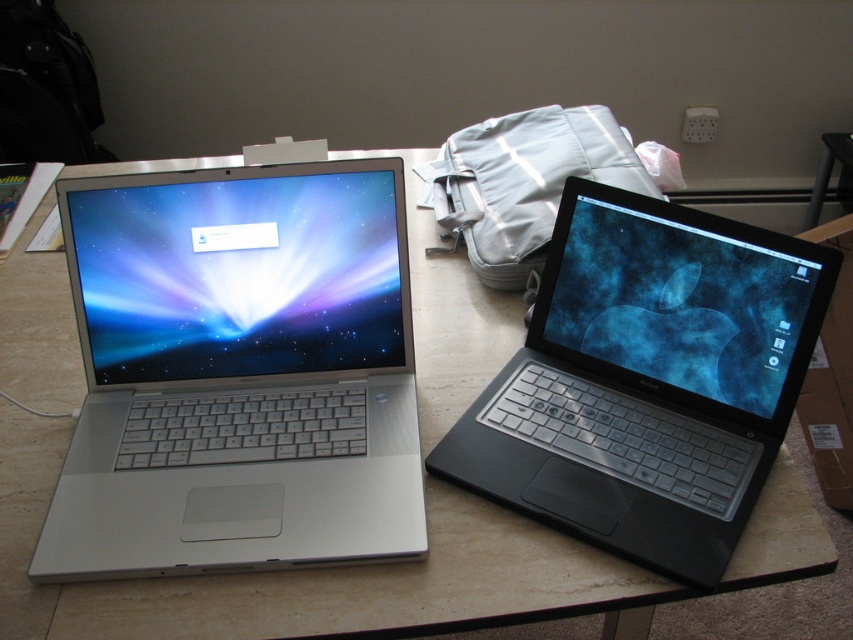
Question: Which point is closer to the camera?

Choices:
 (A) coord(579,337)
 (B) coord(192,483)
 (C) coord(598,160)

Answer: (B)

Question: Which point appears farthest from the camera in this image?

Choices:
 (A) (293, 355)
 (B) (496, 289)

Answer: (B)

Question: Which is farther from the black glossy laptop at right?

Choices:
 (A) silver metallic laptop at left
 (B) matte white backpack at center

Answer: (B)

Question: Is black glossy laptop at right above matte white backpack at center?

Choices:
 (A) yes
 (B) no

Answer: (B)

Question: From the image, what is the correct spatial relationship of silver metallic laptop at left in relation to matte white backpack at center?

Choices:
 (A) right
 (B) left

Answer: (B)

Question: Is black glossy laptop at right wider than matte white backpack at center?

Choices:
 (A) yes
 (B) no

Answer: (A)